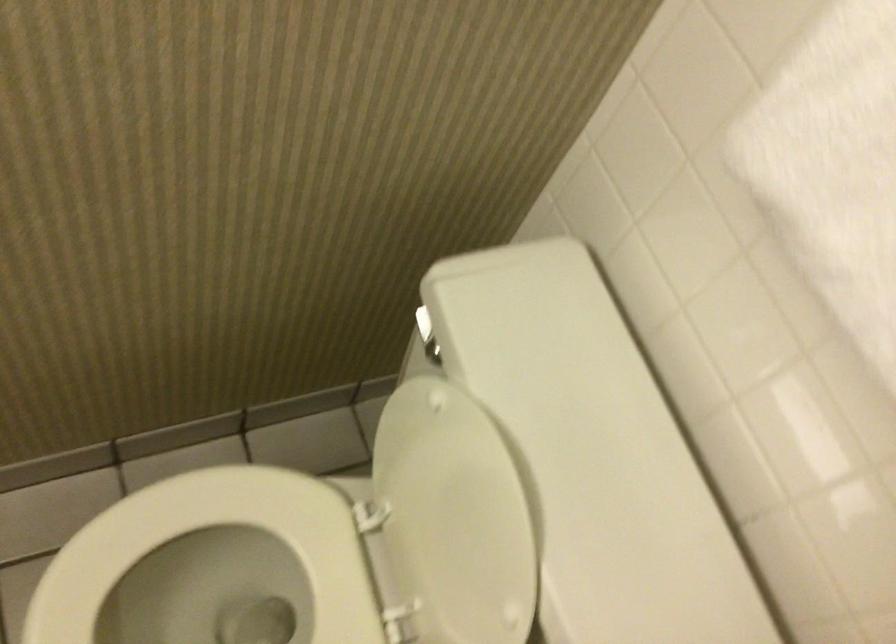
Find the location of a particular element. This screenshot has width=896, height=644. white toilet seat is located at coordinates (222, 590).